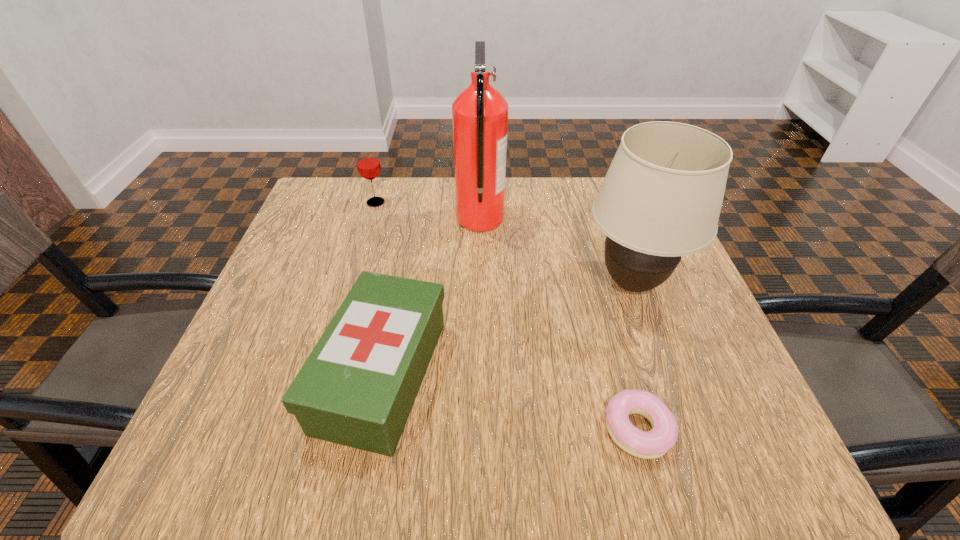
I want to click on free location that satisfies the following two spatial constraints: 1. at the nozzle of the doughnut; 2. on the right side of the third object from left to right, so (x=480, y=429).